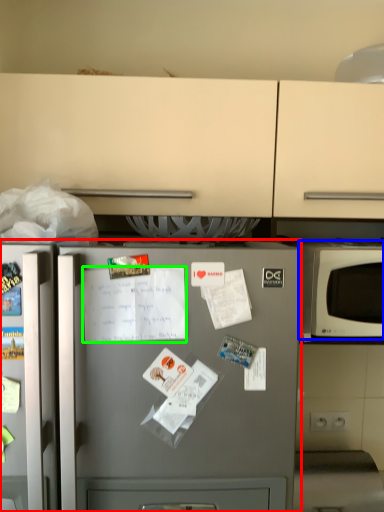
Question: Which is farther away from refrigerator (highlighted by a red box)? microwave oven (highlighted by a blue box) or receipt (highlighted by a green box)?

Choices:
 (A) microwave oven
 (B) receipt

Answer: (A)